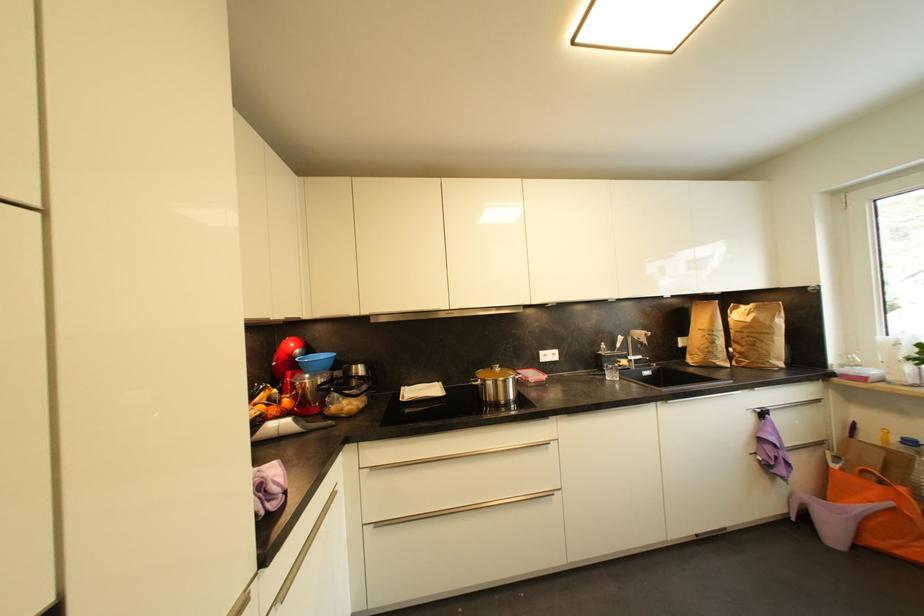
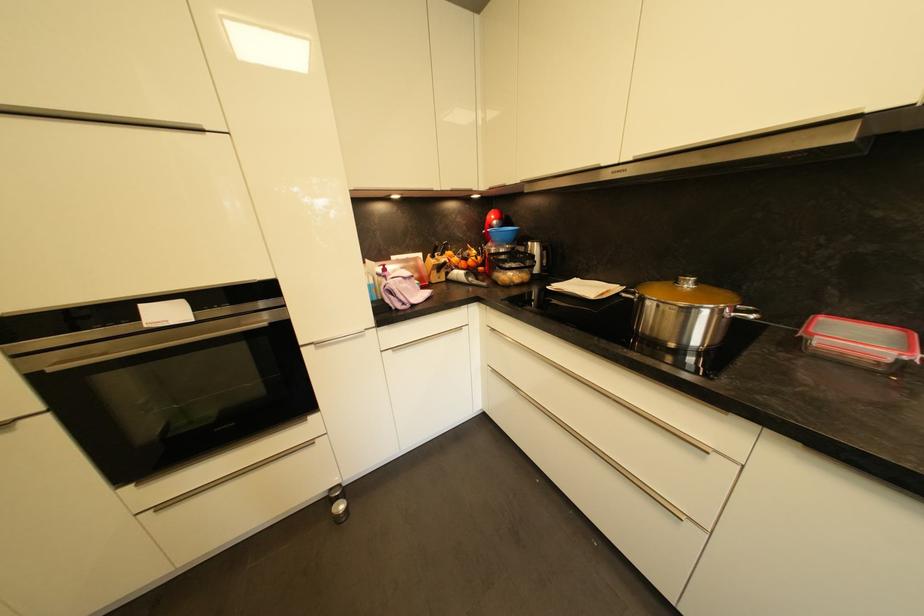
Where in the second image is the point corresponding to the point at 503,371 from the first image?

(694, 286)